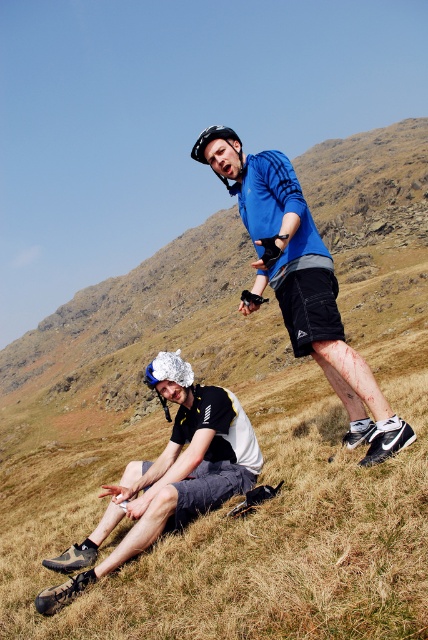
Question: Is brown dry grass at lower center to the left of black matte helmet at upper center from the viewer's perspective?

Choices:
 (A) no
 (B) yes

Answer: (A)

Question: Estimate the real-world distances between objects in this image. Which object is closer to the black mesh shorts at lower left?

Choices:
 (A) blue synthetic jacket at upper center
 (B) brown dry grass at lower center
 (C) black matte helmet at upper center
 (D) silver reflective helmet at center

Answer: (D)

Question: Which point is closer to the camera?

Choices:
 (A) (184, 385)
 (B) (219, 138)
 (C) (398, 397)
 (D) (256, 307)

Answer: (A)

Question: Can you confirm if blue synthetic jacket at upper center is smaller than black mesh shorts at lower left?

Choices:
 (A) yes
 (B) no

Answer: (B)

Question: Does brown dry grass at lower center appear on the left side of black matte helmet at upper center?

Choices:
 (A) no
 (B) yes

Answer: (A)

Question: Which object appears closest to the camera in this image?

Choices:
 (A) blue synthetic jacket at upper center
 (B) black mesh shorts at lower left
 (C) black matte helmet at upper center

Answer: (A)